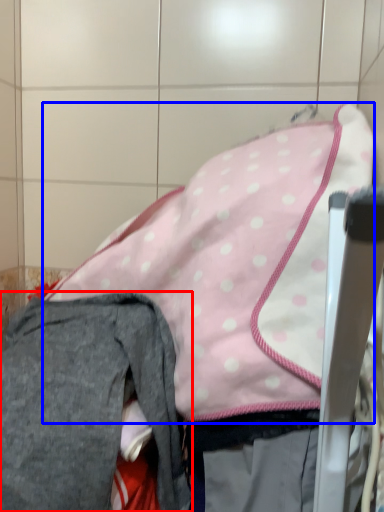
Question: Which object appears farthest to the camera in this image, trousers (highlighted by a red box) or wide (highlighted by a blue box)?

Choices:
 (A) trousers
 (B) wide

Answer: (B)